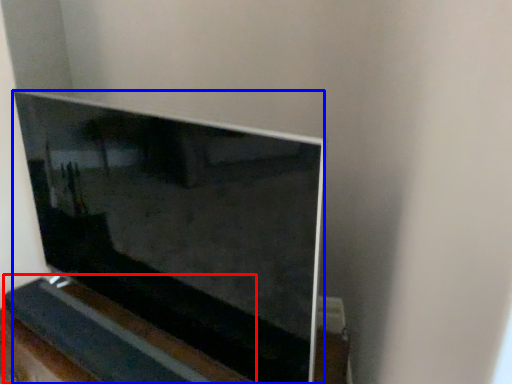
Question: Which of the following is the farthest to the observer, ledge (highlighted by a red box) or television (highlighted by a blue box)?

Choices:
 (A) ledge
 (B) television

Answer: (A)